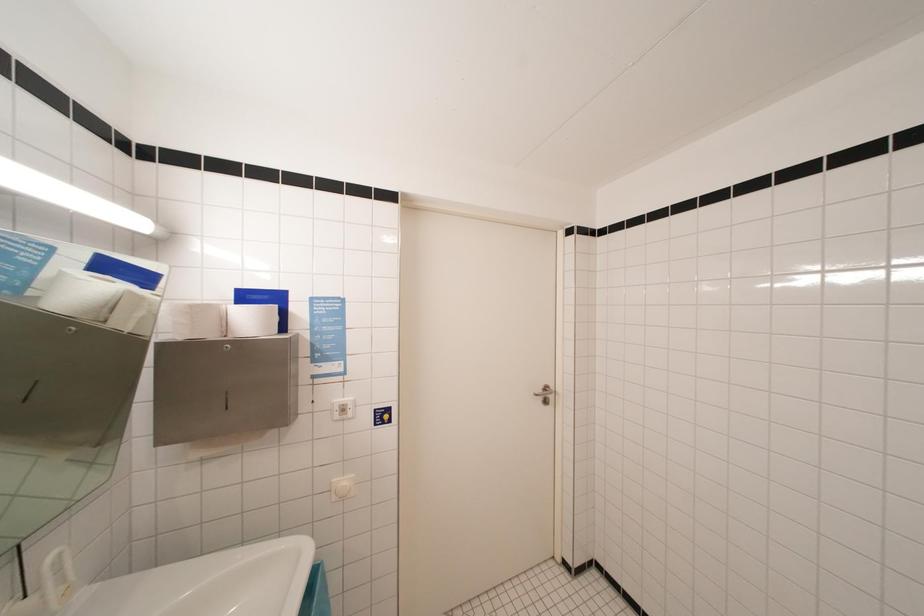
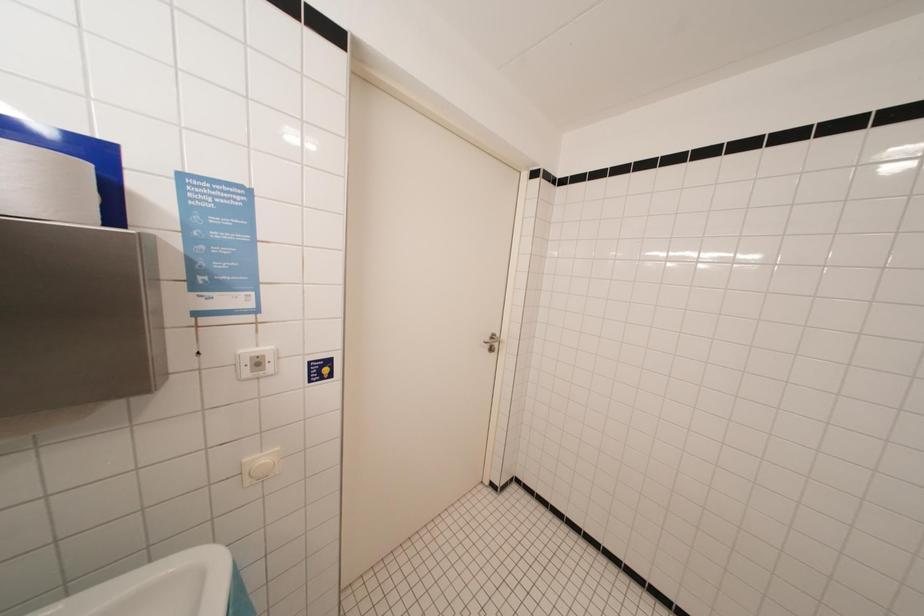
Consider the image. What movement of the cameraman would produce the second image?

The movement direction of the cameraman is left, forward.